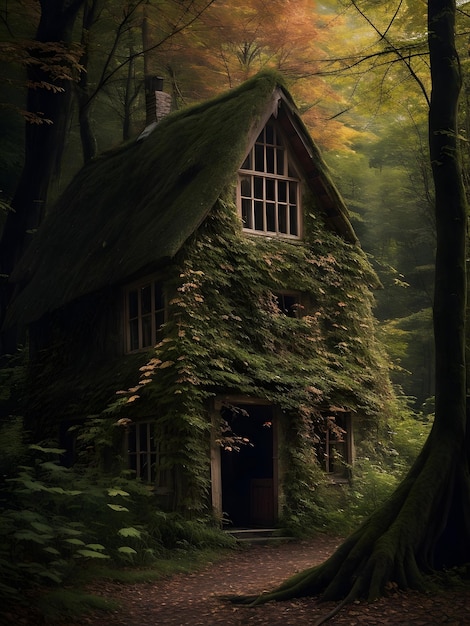
The height and width of the screenshot is (626, 470). What are the coordinates of `glass window pane` in the screenshot? It's located at (145, 295).